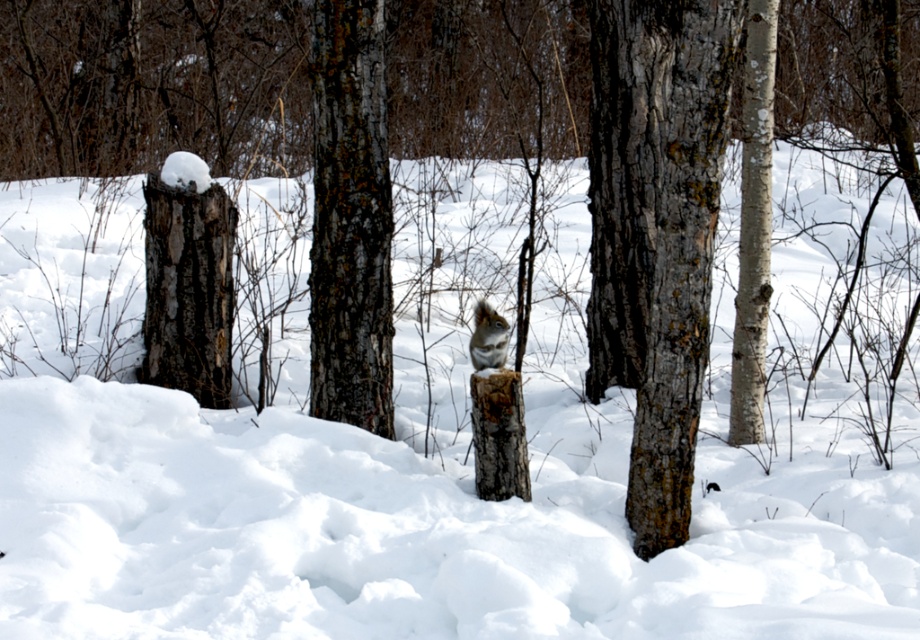
Question: Does grayish-brown bark tree trunk at center appear on the right side of white bark tree at right?

Choices:
 (A) yes
 (B) no

Answer: (B)

Question: Which object appears closest to the camera in this image?

Choices:
 (A) fuzzy brown squirrel at center
 (B) white bark tree at right
 (C) speckled bark tree trunk at center
 (D) grayish-brown bark tree trunk at center

Answer: (D)

Question: Estimate the real-world distances between objects in this image. Which object is closer to the speckled bark tree trunk at center?

Choices:
 (A) white bark tree at right
 (B) fuzzy brown squirrel at center

Answer: (B)

Question: Can you confirm if grayish-brown bark tree trunk at center is positioned below speckled bark tree trunk at center?

Choices:
 (A) no
 (B) yes

Answer: (B)

Question: Can you confirm if grayish-brown bark tree trunk at center is positioned above speckled bark tree trunk at center?

Choices:
 (A) no
 (B) yes

Answer: (A)

Question: Based on their relative distances, which object is farther from the grayish-brown bark tree trunk at center?

Choices:
 (A) white bark tree at right
 (B) speckled bark tree trunk at center

Answer: (B)